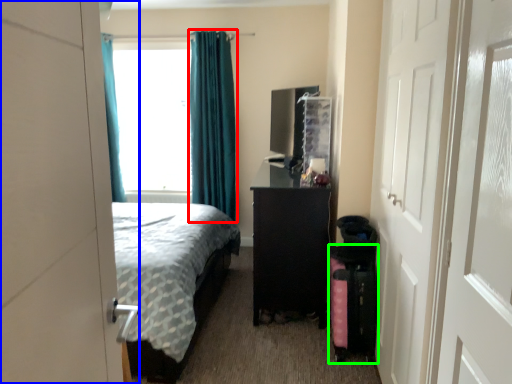
Question: Which object is the farthest from curtain (highlighted by a red box)? Choose among these: door (highlighted by a blue box) or luggage (highlighted by a green box).

Choices:
 (A) door
 (B) luggage

Answer: (A)